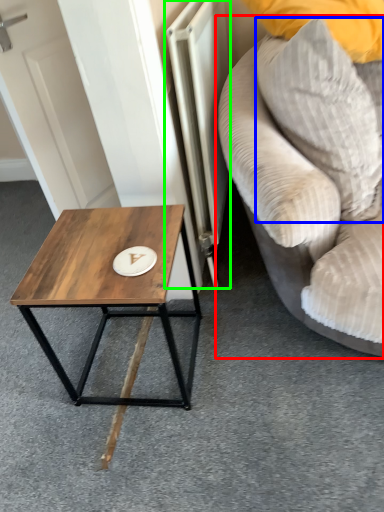
Question: Considering the real-world distances, which object is farthest from studio couch (highlighted by a red box)? pillow (highlighted by a blue box) or radiator (highlighted by a green box)?

Choices:
 (A) pillow
 (B) radiator

Answer: (B)